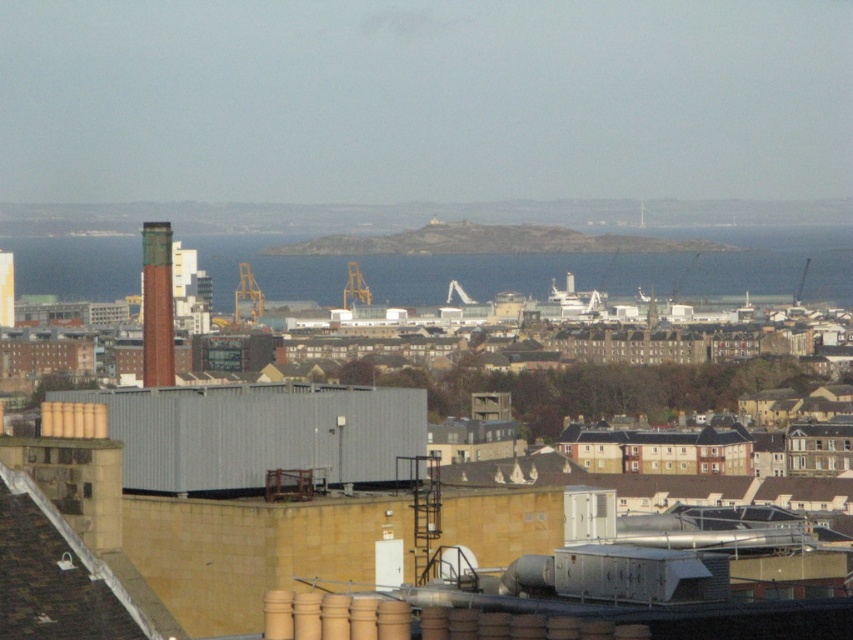
Question: Where is metallic gray factory at center located in relation to green glazed chimney at center-left in the image?

Choices:
 (A) left
 (B) right

Answer: (B)

Question: Among these objects, which one is farthest from the camera?

Choices:
 (A) metallic gray factory at center
 (B) metallic yellow crane at center
 (C) blue water at center

Answer: (B)

Question: Which object is the closest to the metallic gray factory at center?

Choices:
 (A) blue water at center
 (B) metallic yellow crane at center

Answer: (B)

Question: In this image, where is metallic gray factory at center located relative to metallic yellow crane at center?

Choices:
 (A) left
 (B) right

Answer: (B)

Question: Where is blue water at center located in relation to metallic yellow crane at center in the image?

Choices:
 (A) above
 (B) below

Answer: (A)

Question: Which of the following is the farthest from the observer?

Choices:
 (A) yellow metallic crane at center
 (B) metallic gray factory at center

Answer: (A)